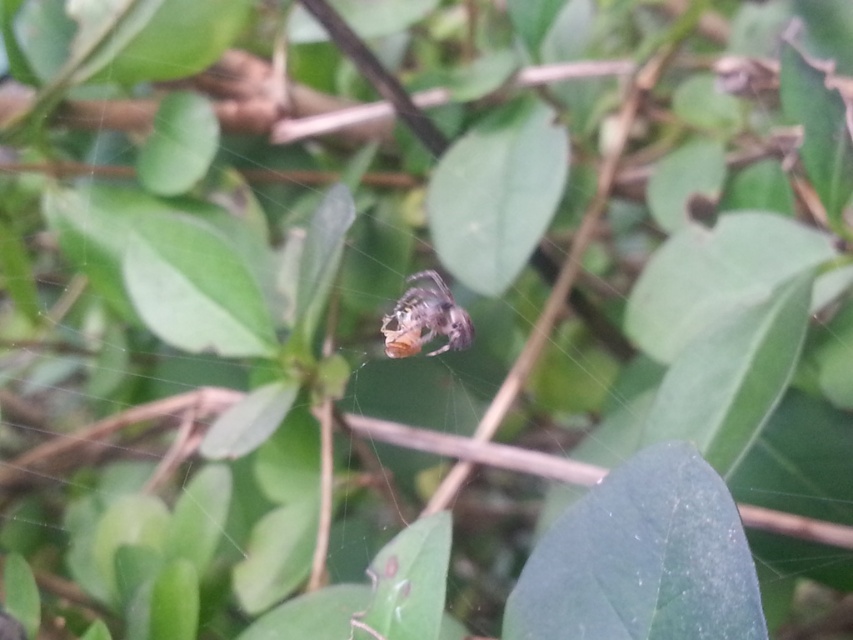
You are standing in a garden and see two points marked in the image. The first point is at coordinates point (637, 616) and the second is at point (427, 328). Which point is closer to you?

Point (637, 616) is in front of point (427, 328), so it is closer to you.

You are a photographer trying to capture the shiny metallic spider at center in your shot. However, you notice the green matte leaf at center is blocking your view. Can you adjust your camera angle to see the spider clearly without moving the leaf?

The green matte leaf at center is in front of the shiny metallic spider at center, so adjusting the camera angle might allow you to see around or above the leaf to get a clear view of the spider without moving it.

You are a gardener holding a 12 inch long tool. You want to reach the shiny metallic spider at center without touching the green matte leaf at center. Is it possible?

The green matte leaf at center is 22.09 inches away from the shiny metallic spider at center. Since your tool is 12 inches long, you can reach the shiny metallic spider at center without touching the green matte leaf at center as the distance between them is greater than the tool length.